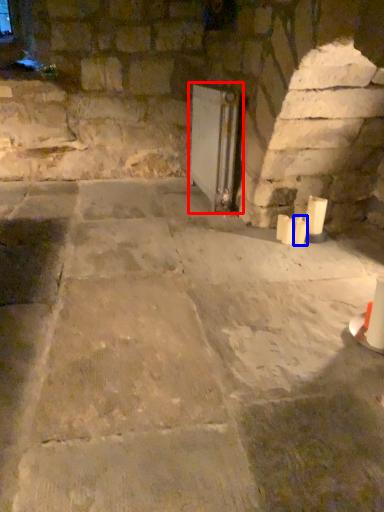
Question: Which object appears farthest to the camera in this image, fireplace (highlighted by a red box) or candle (highlighted by a blue box)?

Choices:
 (A) fireplace
 (B) candle

Answer: (A)